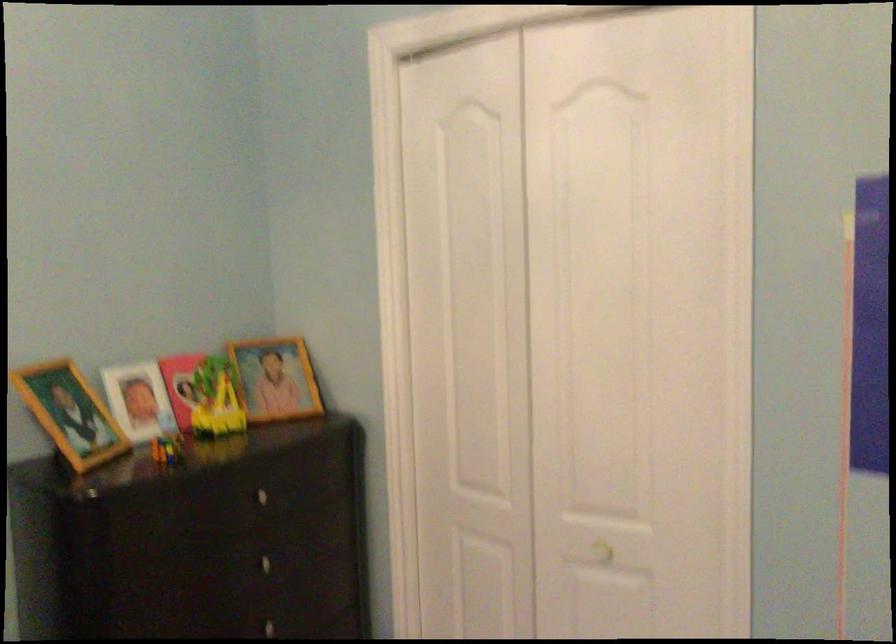
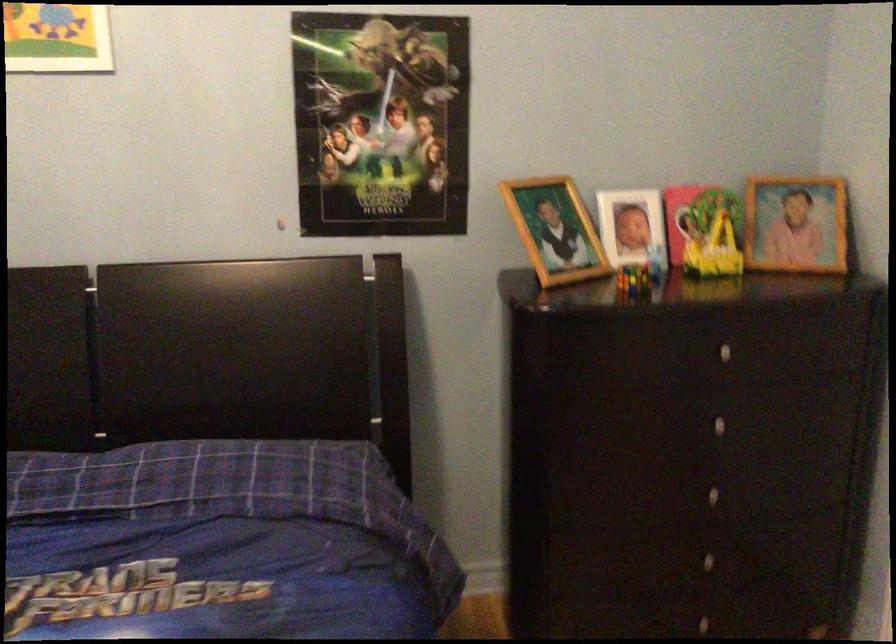
The point at (70,413) is marked in the first image. Where is the corresponding point in the second image?

(555, 230)